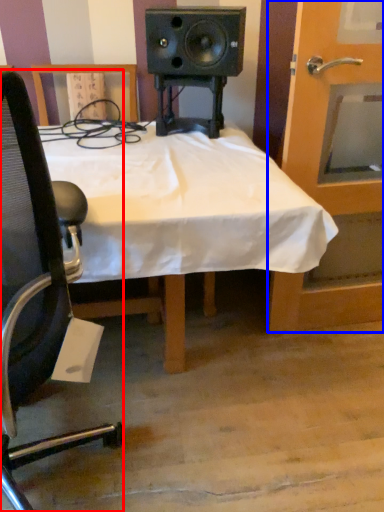
Question: Which object is closer to the camera taking this photo, chair (highlighted by a red box) or door (highlighted by a blue box)?

Choices:
 (A) chair
 (B) door

Answer: (A)